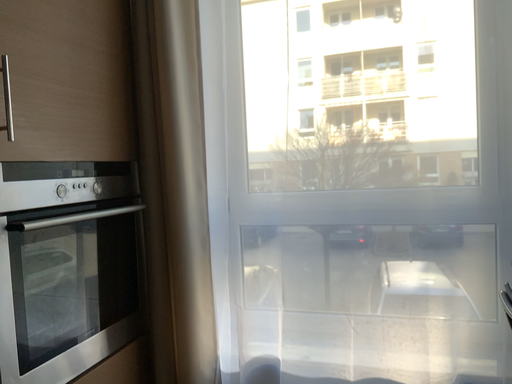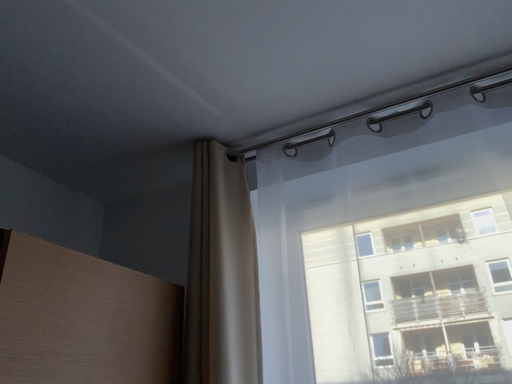
Question: How did the camera likely rotate when shooting the video?

Choices:
 (A) rotated upward
 (B) rotated downward

Answer: (A)